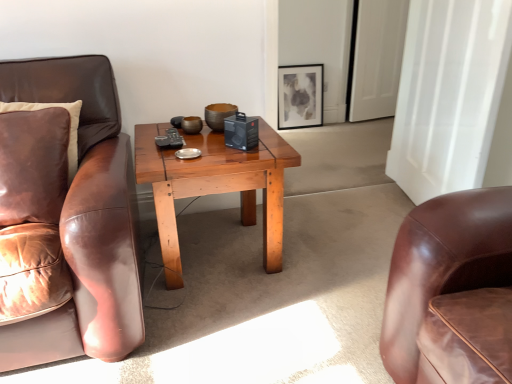
In order to face leather pillow at left, should I rotate leftwards or rightwards?

Rotate left and turn 26.897 degrees.

What do you see at coordinates (69, 128) in the screenshot? This screenshot has width=512, height=384. I see `leather pillow at left` at bounding box center [69, 128].

The height and width of the screenshot is (384, 512). What do you see at coordinates (377, 58) in the screenshot? I see `white glossy door at upper right` at bounding box center [377, 58].

The image size is (512, 384). Find the location of `matte black picture frame at upper center`. matte black picture frame at upper center is located at coordinates (300, 96).

Considering the relative sizes of white glossy door at upper right and wooden coffee table at center in the image provided, is white glossy door at upper right smaller than wooden coffee table at center?

Indeed, white glossy door at upper right has a smaller size compared to wooden coffee table at center.

This screenshot has height=384, width=512. Find the location of `glass door above the wooden coffee table at center (from a real-world perspective)`. glass door above the wooden coffee table at center (from a real-world perspective) is located at coordinates (377, 58).

Is white glossy door at upper right turned away from wooden coffee table at center?

white glossy door at upper right does not have its back to wooden coffee table at center.

How much distance is there between wooden coffee table at center and white glossy door at upper right?

7.46 feet.

Is wooden coffee table at center directly adjacent to white glossy door at upper right?

No, wooden coffee table at center is not touching white glossy door at upper right.

Between wooden coffee table at center and white glossy door at upper right, which one has larger width?

Wider between the two is wooden coffee table at center.

What are the coordinates of `picture frame behind the white glossy door at upper right` in the screenshot? It's located at (300, 96).

Is white glossy door at upper right not within matte black picture frame at upper center?

Yes, white glossy door at upper right is not within matte black picture frame at upper center.

Who is shorter, white glossy door at upper right or matte black picture frame at upper center?

With less height is matte black picture frame at upper center.

From a real-world perspective, does white glossy door at upper right sit lower than matte black picture frame at upper center?

Incorrect, from a real-world perspective, white glossy door at upper right is higher than matte black picture frame at upper center.

Are matte black picture frame at upper center and leather pillow at left located far from each other?

Yes, matte black picture frame at upper center and leather pillow at left are located far from each other.

In the scene shown: Considering the sizes of objects matte black picture frame at upper center and leather pillow at left in the image provided, who is thinner, matte black picture frame at upper center or leather pillow at left?

With smaller width is matte black picture frame at upper center.

From a real-world perspective, which object rests below the other?

In real-world perspective, matte black picture frame at upper center is lower.

You are a GUI agent. You are given a task and a screenshot of the screen. Output one action in this format:
    pyautogui.click(x=<x>, y=<y>)
    Task: Click on the coffee table located in front of the matte black picture frame at upper center
    
    Given the screenshot: What is the action you would take?
    pyautogui.click(x=215, y=185)

Which is more to the left, wooden coffee table at center or matte black picture frame at upper center?

Positioned to the left is wooden coffee table at center.

Based on the photo, does wooden coffee table at center have a greater width compared to matte black picture frame at upper center?

Yes.

Which is in front, wooden coffee table at center or matte black picture frame at upper center?

Positioned in front is wooden coffee table at center.

Which is nearer, (278, 86) or (376, 75)?

Point (278, 86).

Is matte black picture frame at upper center closer to the viewer compared to white glossy door at upper right?

No, matte black picture frame at upper center is further to the viewer.

Are matte black picture frame at upper center and white glossy door at upper right beside each other?

No, matte black picture frame at upper center is not touching white glossy door at upper right.

In terms of height, does wooden coffee table at center look taller or shorter compared to leather pillow at left?

In the image, wooden coffee table at center appears to be taller than leather pillow at left.

From a real-world perspective, is wooden coffee table at center beneath leather pillow at left?

Indeed, from a real-world perspective, wooden coffee table at center is positioned beneath leather pillow at left.

Are wooden coffee table at center and leather pillow at left making contact?

They are not placed beside each other.

How distant is wooden coffee table at center from leather pillow at left?

19.11 inches.

The height and width of the screenshot is (384, 512). Find the location of `glass door above the wooden coffee table at center (from a real-world perspective)`. glass door above the wooden coffee table at center (from a real-world perspective) is located at coordinates (377, 58).

Image resolution: width=512 pixels, height=384 pixels. Find the location of `coffee table that is in front of the white glossy door at upper right`. coffee table that is in front of the white glossy door at upper right is located at coordinates (215, 185).

Based on their spatial positions, is matte black picture frame at upper center or wooden coffee table at center further from white glossy door at upper right?

wooden coffee table at center.

From the image, which object appears to be farther from white glossy door at upper right, matte black picture frame at upper center or leather pillow at left?

Based on the image, leather pillow at left appears to be further to white glossy door at upper right.

Considering their positions, is leather pillow at left positioned closer to matte black picture frame at upper center than white glossy door at upper right?

The object closer to matte black picture frame at upper center is white glossy door at upper right.

Based on their spatial positions, is leather pillow at left or matte black picture frame at upper center further from wooden coffee table at center?

matte black picture frame at upper center is positioned further to the anchor wooden coffee table at center.

Based on their spatial positions, is matte black picture frame at upper center or white glossy door at upper right further from leather pillow at left?

The object further to leather pillow at left is white glossy door at upper right.

When comparing their distances from leather pillow at left, does white glossy door at upper right or wooden coffee table at center seem further?

Among the two, white glossy door at upper right is located further to leather pillow at left.

When comparing their distances from leather pillow at left, does white glossy door at upper right or matte black picture frame at upper center seem closer?

matte black picture frame at upper center is closer to leather pillow at left.

From the image, which object appears to be farther from leather pillow at left, wooden coffee table at center or matte black picture frame at upper center?

matte black picture frame at upper center.

I want to click on coffee table between leather pillow at left and matte black picture frame at upper center in the front-back direction, so click(x=215, y=185).

Find the location of a particular element. Image resolution: width=512 pixels, height=384 pixels. glass door positioned between wooden coffee table at center and matte black picture frame at upper center from near to far is located at coordinates (377, 58).

You are a GUI agent. You are given a task and a screenshot of the screen. Output one action in this format:
    pyautogui.click(x=<x>, y=<y>)
    Task: Click on the glass door between leather pillow at left and matte black picture frame at upper center in the front-back direction
    
    Given the screenshot: What is the action you would take?
    pyautogui.click(x=377, y=58)

Locate an element on the screen. coffee table between leather pillow at left and white glossy door at upper right from front to back is located at coordinates (215, 185).